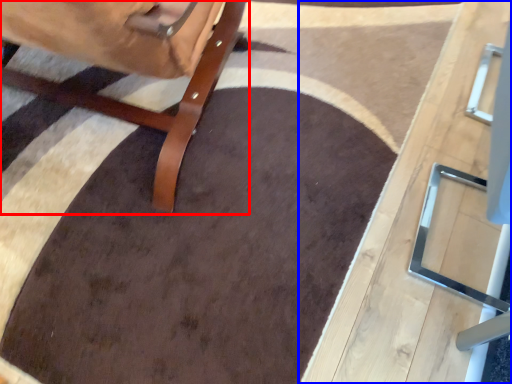
Question: Which of the following is the closest to the observer, furniture (highlighted by a red box) or table (highlighted by a blue box)?

Choices:
 (A) furniture
 (B) table

Answer: (B)